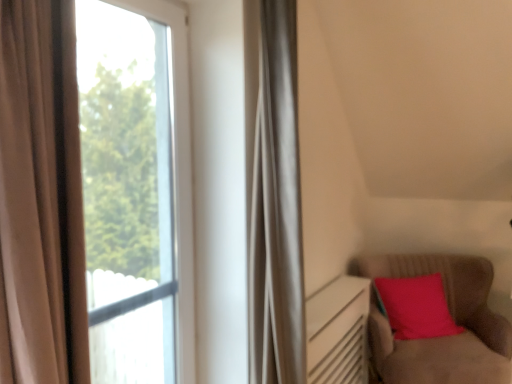
This screenshot has width=512, height=384. I want to click on transparent glass window at left, the 1th window positioned from the left, so click(x=135, y=189).

From the image's perspective, between transparent glass window at left, which ranks as the 1th window in right-to-left order, and velvet-like brown armchair at lower right, which one is located above?

transparent glass window at left, which ranks as the 1th window in right-to-left order, is shown above in the image.

Could you measure the distance between transparent glass window at left, the 2th window in the left-to-right sequence, and velvet-like brown armchair at lower right?

The distance of transparent glass window at left, the 2th window in the left-to-right sequence, from velvet-like brown armchair at lower right is 2.36 meters.

Which is closer, (10, 165) or (391, 264)?

Positioned in front is point (10, 165).

Is transparent glass window at left, which ranks as the 1th window in right-to-left order, facing away from velvet-like brown armchair at lower right?

That's not correct — transparent glass window at left, which ranks as the 1th window in right-to-left order, is not looking away from velvet-like brown armchair at lower right.

Is transparent glass window at left, the 1th window positioned from the left, outside of transparent glass window at left, the 2th window in the left-to-right sequence?

That's correct, transparent glass window at left, the 1th window positioned from the left, is outside of transparent glass window at left, the 2th window in the left-to-right sequence.

Is transparent glass window at left, the 1th window positioned from the left, facing towards transparent glass window at left, the 2th window in the left-to-right sequence?

Yes, transparent glass window at left, the 1th window positioned from the left, is facing transparent glass window at left, the 2th window in the left-to-right sequence.

Is transparent glass window at left, the 1th window positioned from the left, not close to transparent glass window at left, the 2th window in the left-to-right sequence?

transparent glass window at left, the 1th window positioned from the left, is far away from transparent glass window at left, the 2th window in the left-to-right sequence.

Between point (184, 360) and point (11, 323), which one is positioned behind?

The point (184, 360) is behind.

Consider the image. From the image's perspective, is velvet-like brown armchair at lower right on transparent glass window at left, the 2th window in the left-to-right sequence?

No.

Who is shorter, velvet-like brown armchair at lower right or transparent glass window at left, which ranks as the 1th window in right-to-left order?

Standing shorter between the two is velvet-like brown armchair at lower right.

Considering the relative positions of velvet-like brown armchair at lower right and transparent glass window at left, the 2th window in the left-to-right sequence, in the image provided, is velvet-like brown armchair at lower right to the left of transparent glass window at left, the 2th window in the left-to-right sequence, from the viewer's perspective?

No, velvet-like brown armchair at lower right is not to the left of transparent glass window at left, the 2th window in the left-to-right sequence.

The width and height of the screenshot is (512, 384). In order to click on furniture behind the transparent glass window at left, the 2th window in the left-to-right sequence in this screenshot , I will do `click(452, 317)`.

Can we say transparent glass window at left, the 1th window positioned from the left, lies outside velvet-like brown armchair at lower right?

That's correct, transparent glass window at left, the 1th window positioned from the left, is outside of velvet-like brown armchair at lower right.

How many degrees apart are the facing directions of transparent glass window at left, arranged as the 2th window when viewed from the right, and velvet-like brown armchair at lower right?

They differ by 62.5 degrees in their facing directions.

In the scene shown: Is transparent glass window at left, the 1th window positioned from the left, far away from velvet-like brown armchair at lower right?

That's right, there is a large distance between transparent glass window at left, the 1th window positioned from the left, and velvet-like brown armchair at lower right.

From a real-world perspective, between transparent glass window at left, arranged as the 2th window when viewed from the right, and velvet-like brown armchair at lower right, who is vertically lower?

From a 3D spatial view, velvet-like brown armchair at lower right is below.

From the image's perspective, which window is the 1st one above the velvet-like brown armchair at lower right? Please provide its 2D coordinates.

[(135, 189)]

Is point (467, 357) positioned in front of point (137, 242)?

No, it is behind (137, 242).

Looking at this image, is velvet-like brown armchair at lower right to the left of transparent glass window at left, the 1th window positioned from the left, from the viewer's perspective?

No, velvet-like brown armchair at lower right is not to the left of transparent glass window at left, the 1th window positioned from the left.

I want to click on window on the left of transparent glass window at left, which ranks as the 1th window in right-to-left order, so click(x=135, y=189).

Is transparent glass window at left, which ranks as the 1th window in right-to-left order, facing away from transparent glass window at left, arranged as the 2th window when viewed from the right?

Correct, transparent glass window at left, which ranks as the 1th window in right-to-left order, is looking away from transparent glass window at left, arranged as the 2th window when viewed from the right.

In the scene shown: From a real-world perspective, is transparent glass window at left, the 2th window in the left-to-right sequence, over transparent glass window at left, the 1th window positioned from the left?

Yes, from a real-world perspective, transparent glass window at left, the 2th window in the left-to-right sequence, is over transparent glass window at left, the 1th window positioned from the left

Can you confirm if transparent glass window at left, the 2th window in the left-to-right sequence, is positioned to the right of transparent glass window at left, the 1th window positioned from the left?

Yes.

From the image's perspective, count 2nd windows upward from the velvet-like brown armchair at lower right and point to it. Please provide its 2D coordinates.

[(29, 201)]

Where is `window below the transparent glass window at left, the 2th window in the left-to-right sequence (from the image's perspective)`? Image resolution: width=512 pixels, height=384 pixels. window below the transparent glass window at left, the 2th window in the left-to-right sequence (from the image's perspective) is located at coordinates (135, 189).

Based on their spatial positions, is transparent glass window at left, which ranks as the 1th window in right-to-left order, or velvet-like brown armchair at lower right closer to transparent glass window at left, arranged as the 2th window when viewed from the right?

velvet-like brown armchair at lower right is positioned closer to the anchor transparent glass window at left, arranged as the 2th window when viewed from the right.

Estimate the real-world distances between objects in this image. Which object is closer to transparent glass window at left, which ranks as the 1th window in right-to-left order, transparent glass window at left, the 1th window positioned from the left, or velvet-like brown armchair at lower right?

Among the two, transparent glass window at left, the 1th window positioned from the left, is located nearer to transparent glass window at left, which ranks as the 1th window in right-to-left order.

Estimate the real-world distances between objects in this image. Which object is further from transparent glass window at left, the 1th window positioned from the left, velvet-like brown armchair at lower right or transparent glass window at left, which ranks as the 1th window in right-to-left order?

Among the two, transparent glass window at left, which ranks as the 1th window in right-to-left order, is located further to transparent glass window at left, the 1th window positioned from the left.

Based on the photo, looking at the image, which one is located closer to velvet-like brown armchair at lower right, transparent glass window at left, the 1th window positioned from the left, or transparent glass window at left, which ranks as the 1th window in right-to-left order?

transparent glass window at left, the 1th window positioned from the left, is closer to velvet-like brown armchair at lower right.

From the image, which object appears to be farther from transparent glass window at left, which ranks as the 1th window in right-to-left order, velvet-like brown armchair at lower right or transparent glass window at left, arranged as the 2th window when viewed from the right?

velvet-like brown armchair at lower right lies further to transparent glass window at left, which ranks as the 1th window in right-to-left order, than the other object.

Looking at the image, which one is located further to velvet-like brown armchair at lower right, transparent glass window at left, the 2th window in the left-to-right sequence, or transparent glass window at left, arranged as the 2th window when viewed from the right?

Based on the image, transparent glass window at left, the 2th window in the left-to-right sequence, appears to be further to velvet-like brown armchair at lower right.

Identify the location of window between transparent glass window at left, the 1th window positioned from the left, and velvet-like brown armchair at lower right. This screenshot has height=384, width=512. 29,201.